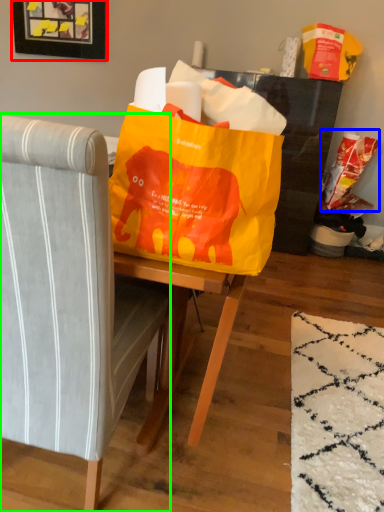
Question: Based on their relative distances, which object is farther from picture frame (highlighted by a red box)? Choose from grocery bag (highlighted by a blue box) and chair (highlighted by a green box).

Choices:
 (A) grocery bag
 (B) chair

Answer: (B)